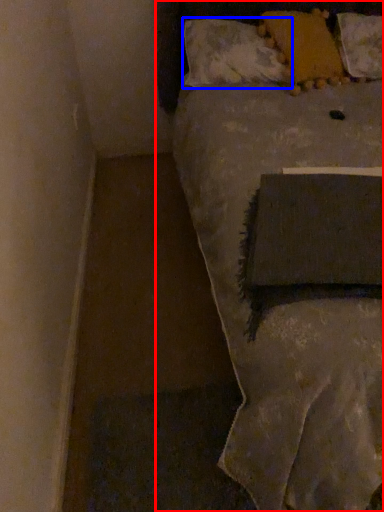
Question: Which object is closer to the camera taking this photo, bed (highlighted by a red box) or pillow (highlighted by a blue box)?

Choices:
 (A) bed
 (B) pillow

Answer: (A)